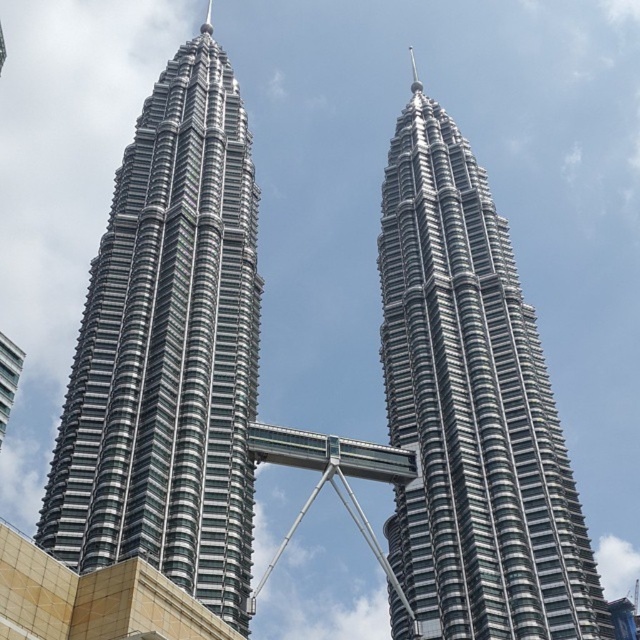
You are standing in front of the Petronas Twin Towers and want to take a photo of both the silver glass skyscraper at center and the metallic glass skyscraper at center. Which one should you frame first on the left side of your camera viewfinder?

The silver glass skyscraper at center is positioned on the left side of the metallic glass skyscraper at center, so you should frame the silver glass skyscraper at center first on the left side of your camera viewfinder.

You are a tourist visiting Kuala Lumpur and want to take a photo of both the silver glass skyscraper at center and the metallic glass skyscraper at center. You notice that one of them is much taller than the other. Which skyscraper should you focus on to ensure both are fully visible in your photo?

The silver glass skyscraper at center is much taller than the metallic glass skyscraper at center. To ensure both are fully visible in your photo, you should focus on the silver glass skyscraper at center as it is taller, allowing the shorter metallic glass skyscraper at center to fit within the frame.

You are standing at the observation deck of the Petronas Twin Towers and looking out. There is a point marked at coordinates point (168, 349). What does this point correspond to in the scene?

The point (168, 349) corresponds to the silver glass skyscraper at center.